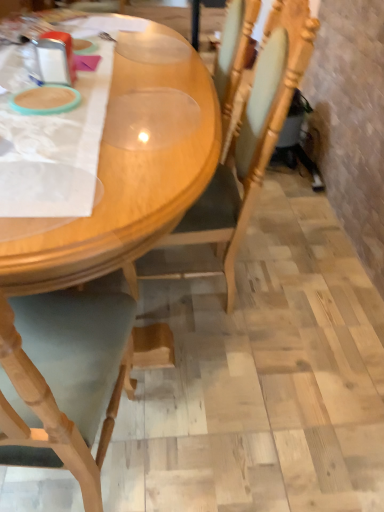
Describe the element at coordinates (112, 229) in the screenshot. The width and height of the screenshot is (384, 512). I see `wooden table at center` at that location.

Locate an element on the screen. This screenshot has height=512, width=384. wooden table at center is located at coordinates (112, 229).

Measure the distance between wooden table at center and camera.

wooden table at center and camera are 17.34 inches apart.

Identify the location of wooden chair at center. The image size is (384, 512). (242, 154).

This screenshot has width=384, height=512. What do you see at coordinates (242, 154) in the screenshot? I see `wooden chair at center` at bounding box center [242, 154].

Measure the distance between point (x=280, y=116) and camera.

The distance of point (x=280, y=116) from camera is 1.21 meters.

Where is `wooden table at center`? wooden table at center is located at coordinates (112, 229).

Is wooden chair at center at the left side of wooden table at center?

In fact, wooden chair at center is to the right of wooden table at center.

Between wooden chair at center and wooden table at center, which one is positioned in front?

Positioned in front is wooden table at center.

Does point (289, 89) come farther from viewer compared to point (21, 225)?

Yes, it is.

From the image's perspective, would you say wooden chair at center is positioned over wooden table at center?

No, from the image's perspective, wooden chair at center is not over wooden table at center.

From a real-world perspective, who is located lower, wooden chair at center or wooden table at center?

From a 3D spatial view, wooden table at center is below.

Does wooden chair at center have a lesser width compared to wooden table at center?

Indeed, wooden chair at center has a lesser width compared to wooden table at center.

Considering the sizes of objects wooden chair at center and wooden table at center in the image provided, who is shorter, wooden chair at center or wooden table at center?

With less height is wooden table at center.

In terms of size, does wooden chair at center appear bigger or smaller than wooden table at center?

Considering their sizes, wooden chair at center takes up less space than wooden table at center.

Is wooden chair at center inside the boundaries of wooden table at center, or outside?

The correct answer is: inside.

Is wooden chair at center beside wooden table at center?

No, wooden chair at center is not touching wooden table at center.

Could you tell me if wooden chair at center is facing wooden table at center?

Yes, wooden chair at center is facing wooden table at center.

Can you tell me how much wooden chair at center and wooden table at center differ in facing direction?

178 degrees separate the facing orientations of wooden chair at center and wooden table at center.

Identify the location of chair below the wooden table at center (from the image's perspective). (242, 154).

Which is more to the right, wooden table at center or wooden chair at center?

wooden chair at center is more to the right.

Relative to wooden chair at center, is wooden table at center in front or behind?

wooden table at center is in front of wooden chair at center.

Considering the positions of point (163, 131) and point (228, 242), is point (163, 131) closer or farther from the camera than point (228, 242)?

Point (163, 131) is positioned closer to the camera compared to point (228, 242).

From the image's perspective, is wooden table at center above or below wooden chair at center?

Clearly, from the image's perspective, wooden table at center is above wooden chair at center.

From a real-world perspective, is wooden table at center on wooden chair at center?

No.

Can you confirm if wooden table at center is wider than wooden chair at center?

Yes.

From the picture: Can you confirm if wooden table at center is shorter than wooden chair at center?

Indeed, wooden table at center has a lesser height compared to wooden chair at center.

Considering the sizes of objects wooden table at center and wooden chair at center in the image provided, who is smaller, wooden table at center or wooden chair at center?

wooden chair at center is smaller.

Is wooden table at center not within wooden chair at center?

Yes, wooden table at center is outside of wooden chair at center.

In the scene shown: Is wooden table at center not close to wooden chair at center?

wooden table at center is actually quite close to wooden chair at center.

Does wooden table at center turn towards wooden chair at center?

Yes, wooden table at center is aimed at wooden chair at center.

Can you tell me how much wooden table at center and wooden chair at center differ in facing direction?

The angular difference between wooden table at center and wooden chair at center is 178 degrees.

Measure the distance from wooden table at center to wooden chair at center.

wooden table at center is 14.68 inches from wooden chair at center.

You are a GUI agent. You are given a task and a screenshot of the screen. Output one action in this format:
    pyautogui.click(x=<x>, y=<y>)
    Task: Click on the table on the left of wooden chair at center
    
    Given the screenshot: What is the action you would take?
    pyautogui.click(x=112, y=229)

I want to click on table in front of the wooden chair at center, so click(112, 229).

Identify the location of table on the left of wooden chair at center. This screenshot has width=384, height=512. (112, 229).